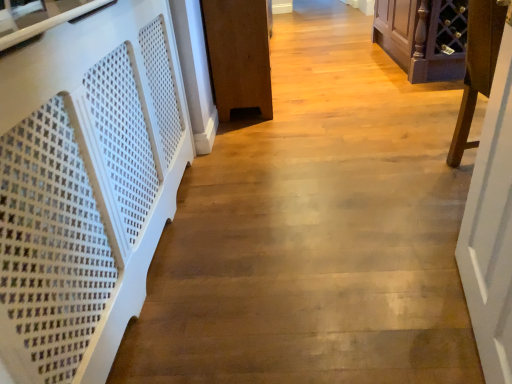
The height and width of the screenshot is (384, 512). In order to click on free spot behind purple wood wine rack at right, which appears as the 2th furniture when viewed from the left in this screenshot , I will do [416, 141].